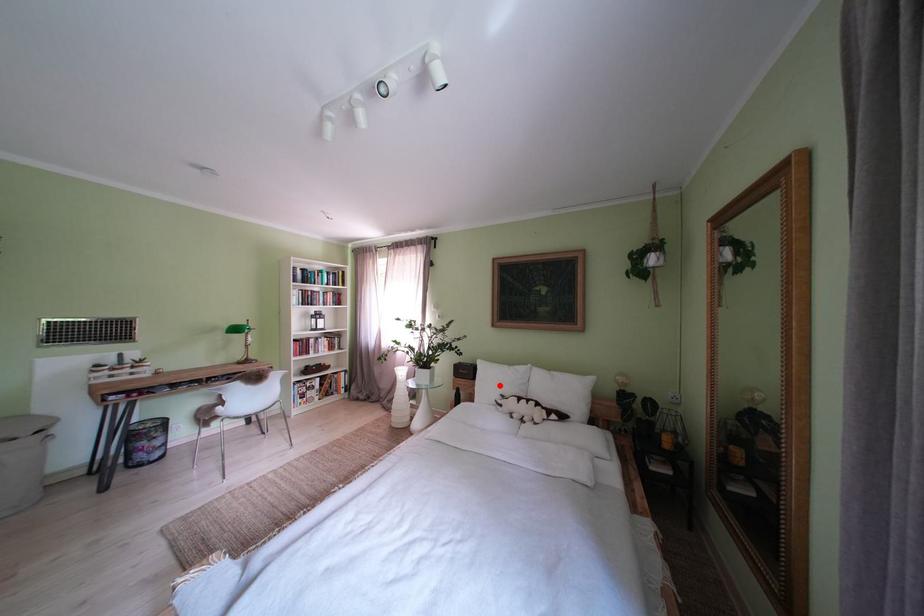
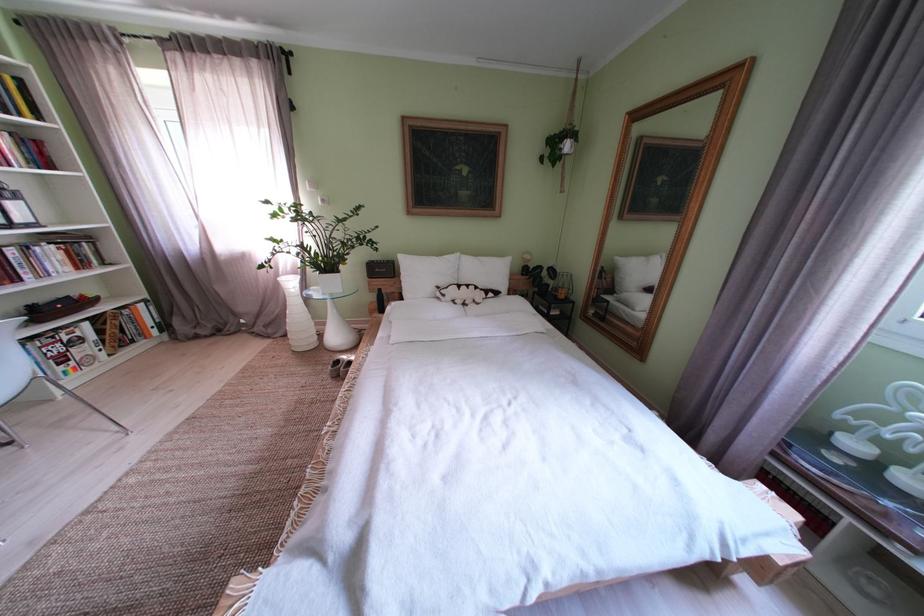
The point at the highlighted location is marked in the first image. Where is the corresponding point in the second image?

(429, 280)